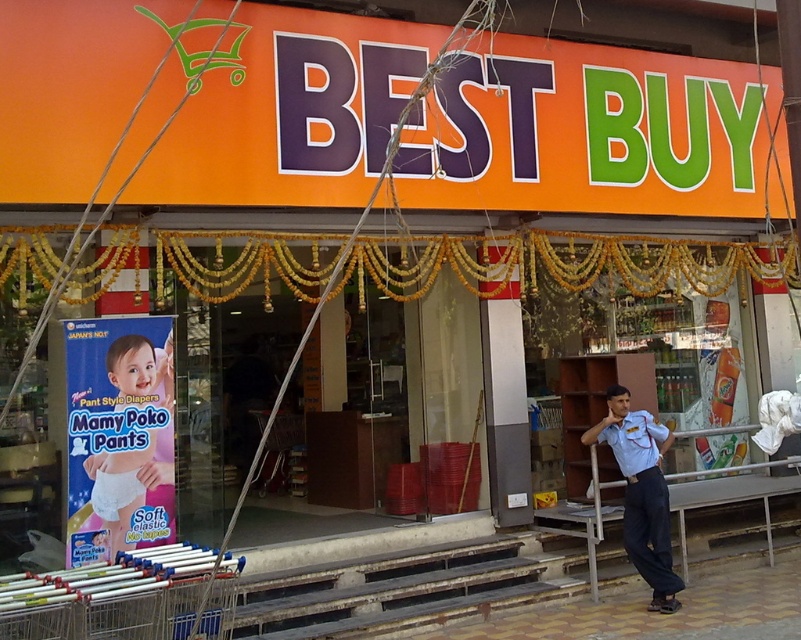
Question: Can you confirm if light blue uniform at center is thinner than soft plastic diaper at lower left?

Choices:
 (A) yes
 (B) no

Answer: (B)

Question: Which object is closer to the camera taking this photo?

Choices:
 (A) soft plastic diaper at lower left
 (B) light blue uniform at center

Answer: (A)

Question: Observing the image, what is the correct spatial positioning of light blue uniform at center in reference to soft plastic diaper at lower left?

Choices:
 (A) below
 (B) above

Answer: (A)

Question: Does light blue uniform at center have a smaller size compared to soft plastic diaper at lower left?

Choices:
 (A) no
 (B) yes

Answer: (A)